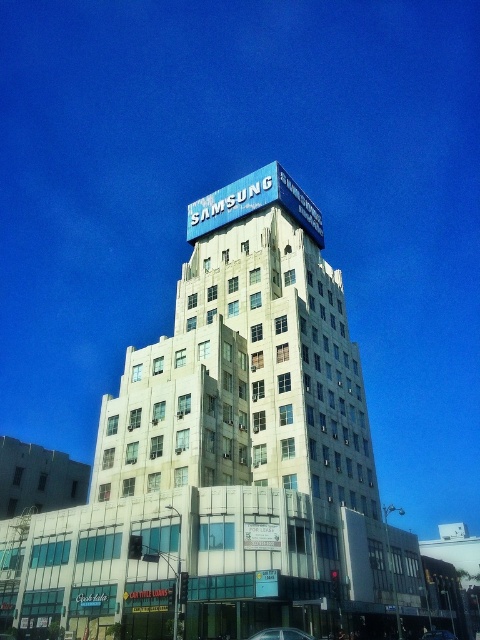
Is point (115, 568) more distant than point (452, 634)?

No.

Is white glass building at center wider than shiny blue car at center?

Correct, the width of white glass building at center exceeds that of shiny blue car at center.

Between point (120, 637) and point (453, 637), which one is positioned in front?

Point (120, 637)

What are the coordinates of `white glass building at center` in the screenshot? It's located at (226, 465).

Is white glass building at center wider than shiny silver car at center?

Yes, white glass building at center is wider than shiny silver car at center.

How distant is white glass building at center from shiny silver car at center?

80.29 feet

Is point (376, 504) less distant than point (249, 637)?

No.

Where is `white glass building at center`? white glass building at center is located at coordinates (226, 465).

Is shiny silver car at center below shiny blue car at center?

No, shiny silver car at center is not below shiny blue car at center.

Is shiny silver car at center behind shiny blue car at center?

No, it is in front of shiny blue car at center.

The width and height of the screenshot is (480, 640). What do you see at coordinates (280, 634) in the screenshot? I see `shiny silver car at center` at bounding box center [280, 634].

You are a GUI agent. You are given a task and a screenshot of the screen. Output one action in this format:
    pyautogui.click(x=<x>, y=<y>)
    Task: Click on the shiny silver car at center
    This screenshot has height=640, width=480.
    Given the screenshot: What is the action you would take?
    pyautogui.click(x=280, y=634)